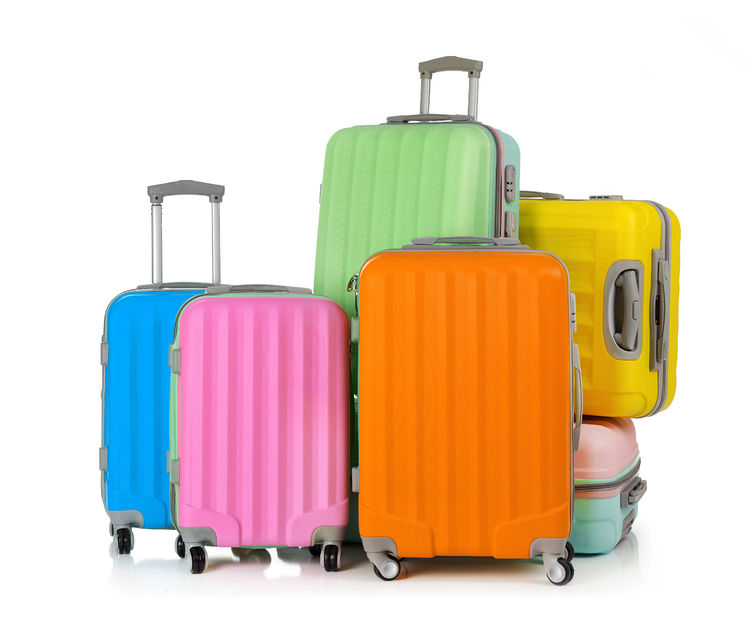
The image size is (756, 633). I want to click on handles, so click(426, 116), click(181, 282), click(255, 287), click(465, 246), click(664, 308), click(629, 522).